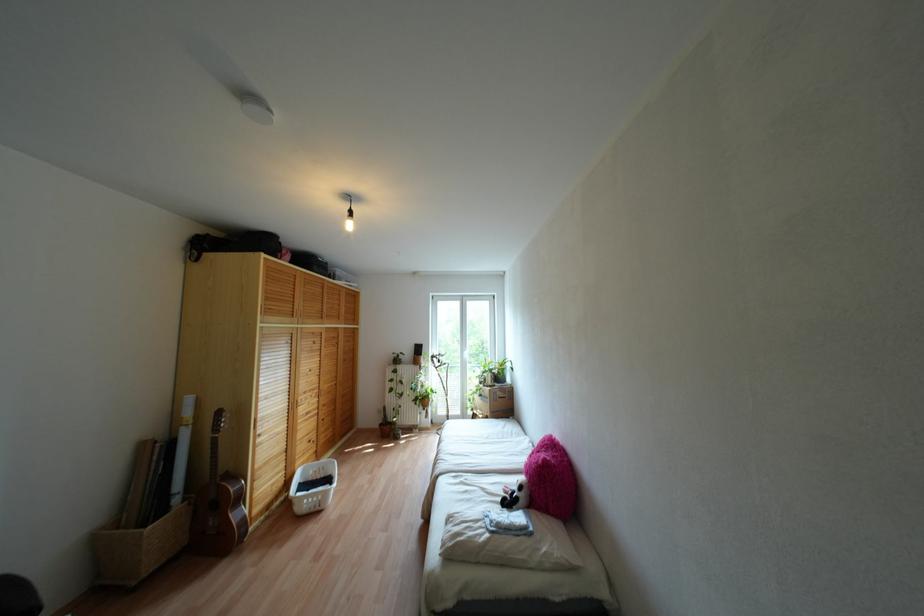
Find where to lift the acoustic guitar. Please return your answer as a coordinate pair (x, y).

(217, 505)